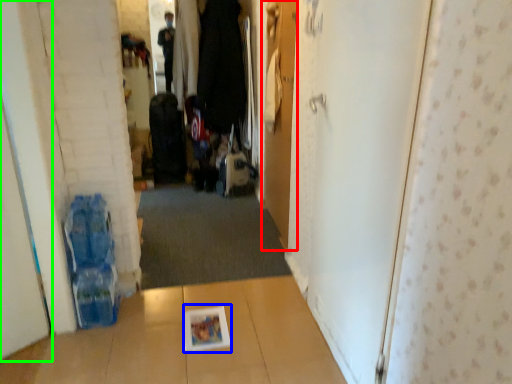
Question: Which object is positioned closest to door (highlighted by a red box)? Select from magazine (highlighted by a blue box) and door (highlighted by a green box).

Choices:
 (A) magazine
 (B) door

Answer: (A)